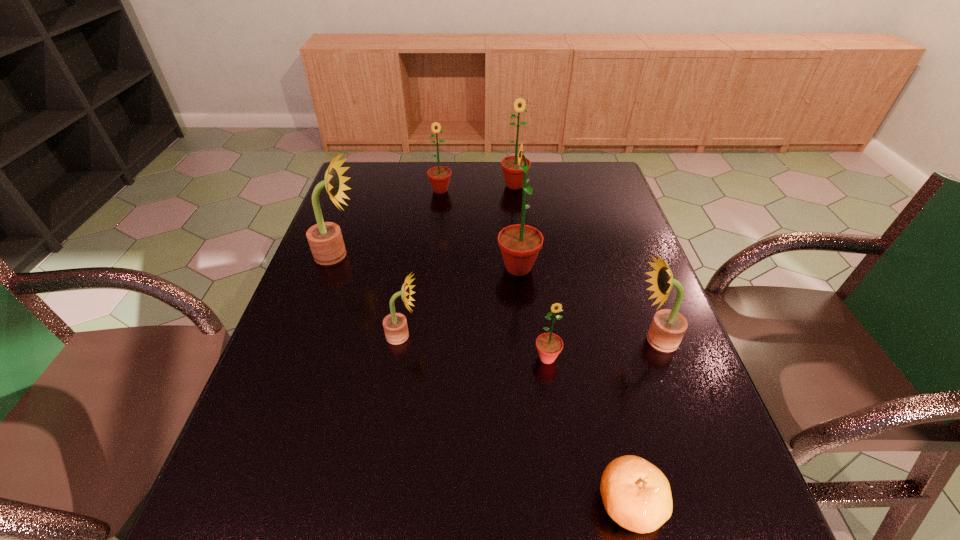
Select which yellow sunflower appears as the third closest to the nearest object. Please provide its 2D coordinates. Your answer should be formatted as a tuple, i.e. [(x, y)], where the tuple contains the x and y coordinates of a point satisfying the conditions above.

[(325, 239)]

Where is `the second closest yellow sunflower to the shortest object`? The width and height of the screenshot is (960, 540). the second closest yellow sunflower to the shortest object is located at coordinates (395, 326).

What are the coordinates of `free spot that satisfies the following two spatial constraints: 1. on the face of the third biggest green sunflower; 2. on the face of the leftmost sunflower` in the screenshot? It's located at (433, 255).

Identify the location of free space that satisfies the following two spatial constraints: 1. on the face of the third smallest green sunflower; 2. on the face of the smallest yellow sunflower. (531, 335).